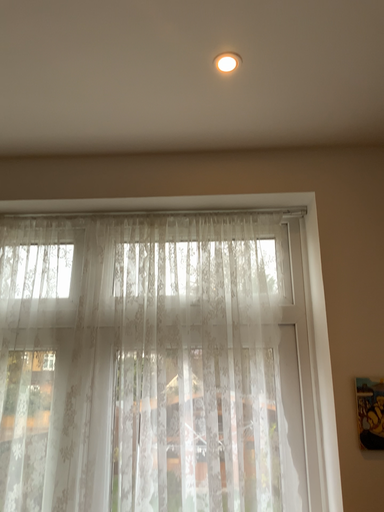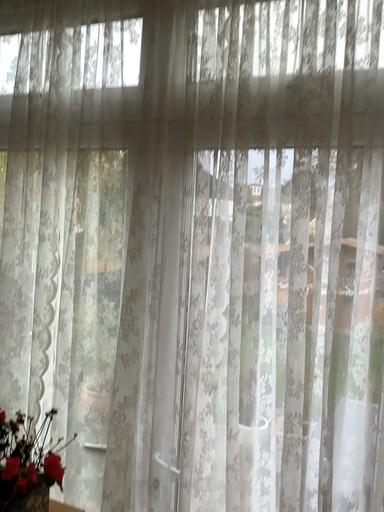
Question: How did the camera likely rotate when shooting the video?

Choices:
 (A) rotated downward
 (B) rotated upward

Answer: (A)